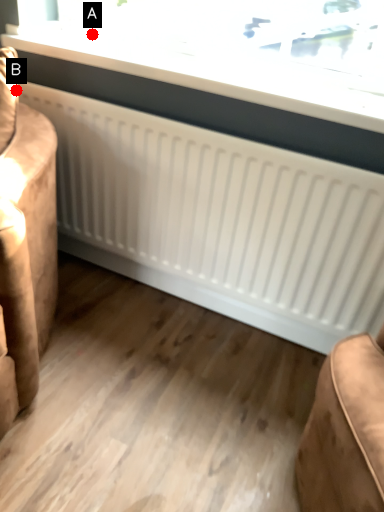
Question: Two points are circled on the image, labeled by A and B beside each circle. Which point is farther from the camera taking this photo?

Choices:
 (A) A is further
 (B) B is further

Answer: (A)